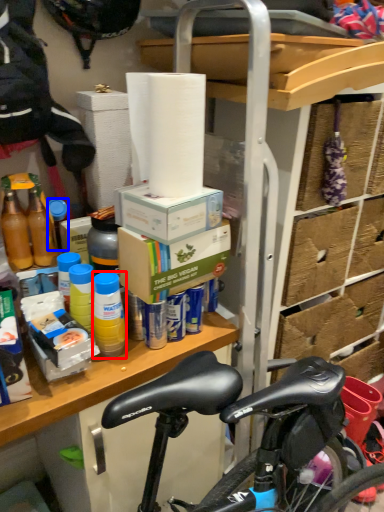
Question: Which object appears farthest to the camera in this image, bottle (highlighted by a red box) or bottle (highlighted by a blue box)?

Choices:
 (A) bottle
 (B) bottle

Answer: (B)